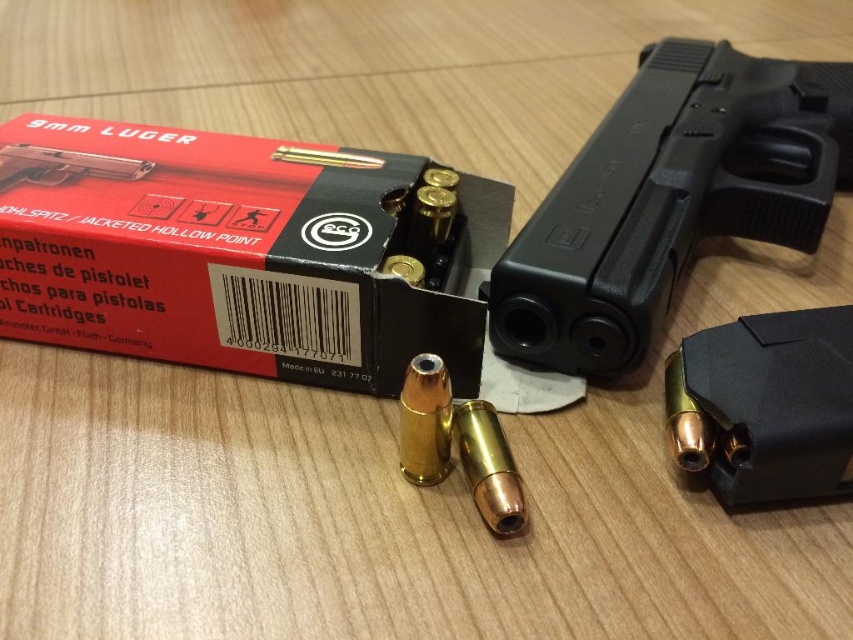
Who is positioned more to the left, red matte box at upper left or black plastic handgun at upper right?

red matte box at upper left

Where is `red matte box at upper left`? This screenshot has width=853, height=640. red matte box at upper left is located at coordinates (244, 252).

In order to click on red matte box at upper left in this screenshot , I will do `click(244, 252)`.